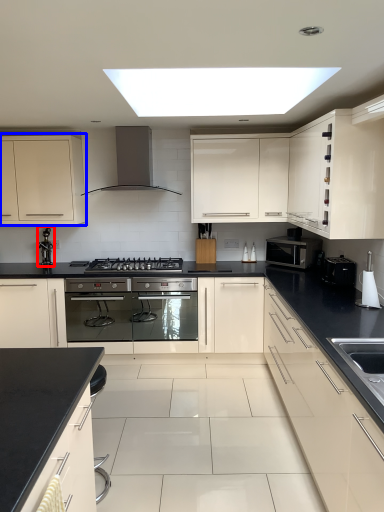
Question: Which of the following is the farthest to the observer, faucet (highlighted by a red box) or cabinetry (highlighted by a blue box)?

Choices:
 (A) faucet
 (B) cabinetry

Answer: (A)